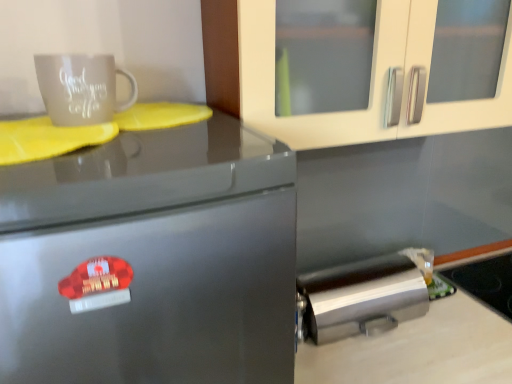
Question: Can you confirm if glassy black stove at lower right is wider than smooth white countertop at lower right?

Choices:
 (A) no
 (B) yes

Answer: (A)

Question: From the image's perspective, is glassy black stove at lower right over smooth white countertop at lower right?

Choices:
 (A) yes
 (B) no

Answer: (A)

Question: Does glassy black stove at lower right have a larger size compared to smooth white countertop at lower right?

Choices:
 (A) no
 (B) yes

Answer: (A)

Question: Is glassy black stove at lower right turned away from smooth white countertop at lower right?

Choices:
 (A) yes
 (B) no

Answer: (A)

Question: Is smooth white countertop at lower right surrounded by glassy black stove at lower right?

Choices:
 (A) yes
 (B) no

Answer: (B)

Question: Is glassy black stove at lower right thinner than smooth white countertop at lower right?

Choices:
 (A) yes
 (B) no

Answer: (A)

Question: Does matte ceramic mug at upper left have a smaller size compared to brushed metal trash can at lower right?

Choices:
 (A) yes
 (B) no

Answer: (A)

Question: Is matte ceramic mug at upper left wider than brushed metal trash can at lower right?

Choices:
 (A) no
 (B) yes

Answer: (A)

Question: Are matte ceramic mug at upper left and brushed metal trash can at lower right making contact?

Choices:
 (A) no
 (B) yes

Answer: (A)

Question: From the image's perspective, is matte ceramic mug at upper left on top of brushed metal trash can at lower right?

Choices:
 (A) yes
 (B) no

Answer: (A)

Question: Is the position of matte ceramic mug at upper left less distant than that of brushed metal trash can at lower right?

Choices:
 (A) yes
 (B) no

Answer: (A)

Question: Does matte ceramic mug at upper left come behind brushed metal trash can at lower right?

Choices:
 (A) yes
 (B) no

Answer: (B)

Question: Is satin silver fridge at left smaller than brushed metal trash can at lower right?

Choices:
 (A) no
 (B) yes

Answer: (A)